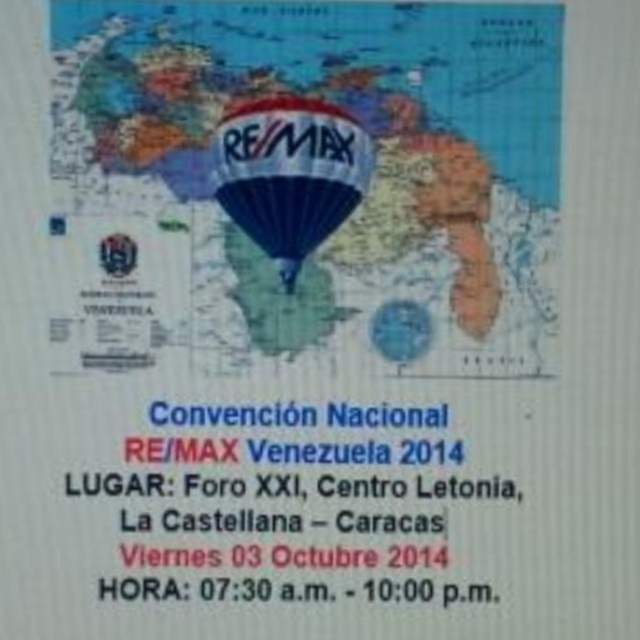
Consider the image. Between map at center and blue glossy balloon at center, which one is positioned lower?

Positioned lower is blue glossy balloon at center.

Identify the location of map at center. This screenshot has width=640, height=640. coord(308,186).

You are a GUI agent. You are given a task and a screenshot of the screen. Output one action in this format:
    pyautogui.click(x=<x>, y=<y>)
    Task: Click on the map at center
    The width and height of the screenshot is (640, 640).
    Given the screenshot: What is the action you would take?
    pyautogui.click(x=308, y=186)